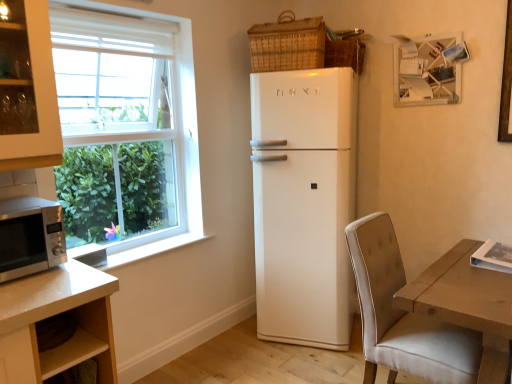
Question: Is white matte picture frame at upper right inside or outside of white glossy refrigerator at center?

Choices:
 (A) inside
 (B) outside

Answer: (B)

Question: Relative to white glossy refrigerator at center, is white matte picture frame at upper right in front or behind?

Choices:
 (A) front
 (B) behind

Answer: (B)

Question: Which object is the farthest from the woven brown basket at upper right, acting as the second basket starting from the right?

Choices:
 (A) white matte picture frame at upper right
 (B) satin silver microwave at lower left
 (C) woven wicker basket at upper right, the 2th basket from the left
 (D) beige fabric chair at lower right
 (E) white glossy refrigerator at center

Answer: (B)

Question: Which is farther from the white glossy refrigerator at center?

Choices:
 (A) white matte picture frame at upper right
 (B) woven wicker basket at upper right, the 2th basket from the left
 (C) beige fabric chair at lower right
 (D) satin silver microwave at lower left
 (E) woven brown basket at upper right, acting as the second basket starting from the right

Answer: (D)